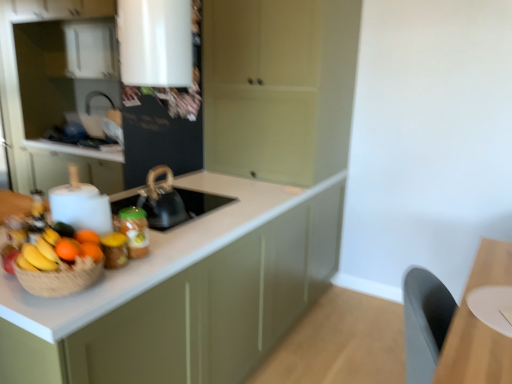
Question: Considering the relative positions of matte white countertop at center, arranged as the second cabinetry when viewed from the right, and matte green cabinet at center, the third cabinetry positioned from the left, in the image provided, is matte white countertop at center, arranged as the second cabinetry when viewed from the right, to the left or to the right of matte green cabinet at center, the third cabinetry positioned from the left,?

Choices:
 (A) left
 (B) right

Answer: (A)

Question: Is point (189, 354) closer or farther from the camera than point (292, 150)?

Choices:
 (A) farther
 (B) closer

Answer: (B)

Question: Which object is positioned closest to the black matte kettle at center?

Choices:
 (A) matte green cabinet at center, the third cabinetry positioned from the left
 (B) orange matte at left, the 1th orange from the front
 (C) orange matte at left, the 3th orange when ordered from front to back
 (D) yellow matte bananas at left
 (E) translucent glass jar at center

Answer: (E)

Question: Which of these objects is positioned closest to the translucent glass jar at center?

Choices:
 (A) matte green cabinet at center, the third cabinetry positioned from the left
 (B) matte white countertop at center, which appears as the 2th cabinetry when viewed from the left
 (C) orange matte at left, the 2th orange when ordered from front to back
 (D) white matte cabinet at left, placed as the first cabinetry when sorted from left to right
 (E) black matte kettle at center

Answer: (E)